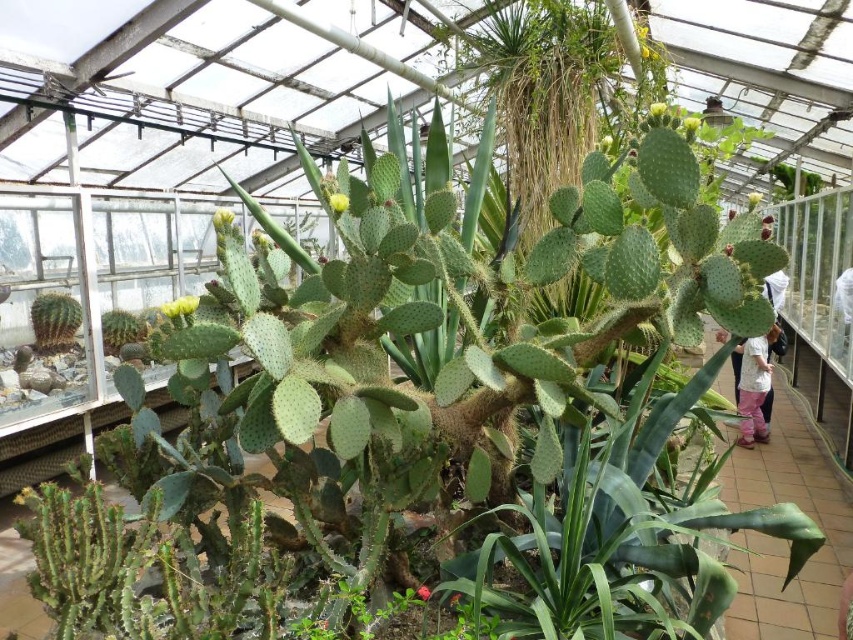
You are standing in the greenhouse and notice a white cotton shirt at right. Based on its position, can you determine if it is closer to the entrance or the back wall?

The white cotton shirt at right is located at point [753,387], which places it closer to the back wall of the greenhouse.